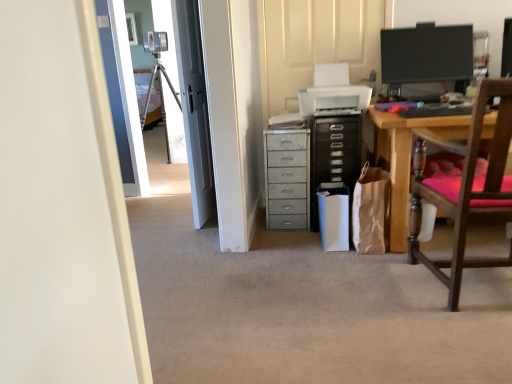
Image resolution: width=512 pixels, height=384 pixels. Identify the location of vacant space underneath wooden chair with pink cushion at right (from a real-world perspective). (463, 292).